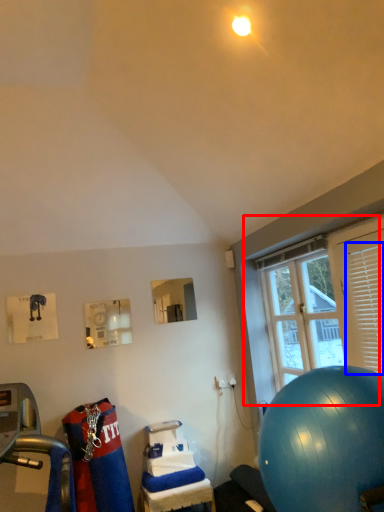
Question: Which object is closer to the camera taking this photo, window (highlighted by a red box) or shutter (highlighted by a blue box)?

Choices:
 (A) window
 (B) shutter

Answer: (B)